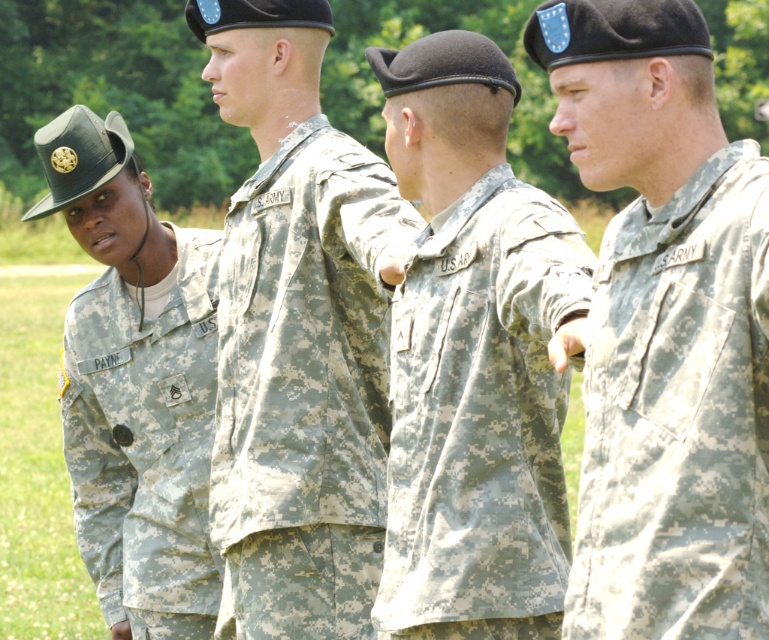
Question: Can you confirm if camouflage fabric uniform at center is positioned above camouflage fabric at center?

Choices:
 (A) yes
 (B) no

Answer: (B)

Question: Does camouflage fabric uniform at right appear on the left side of camouflage fabric uniform at left?

Choices:
 (A) no
 (B) yes

Answer: (A)

Question: Is camouflage fabric at center positioned in front of camouflage fabric uniform at left?

Choices:
 (A) no
 (B) yes

Answer: (B)

Question: Which object is the closest to the camouflage fabric uniform at right?

Choices:
 (A) camouflage fabric uniform at center
 (B) camouflage fabric uniform at left
 (C) camouflage fabric at center

Answer: (C)

Question: Which of the following is the closest to the observer?

Choices:
 (A) camouflage fabric at center
 (B) camouflage fabric uniform at center
 (C) camouflage fabric uniform at left

Answer: (A)

Question: Which of the following is the farthest from the observer?

Choices:
 (A) (165, 582)
 (B) (283, 164)
 (C) (488, 177)
 (D) (696, 378)

Answer: (A)